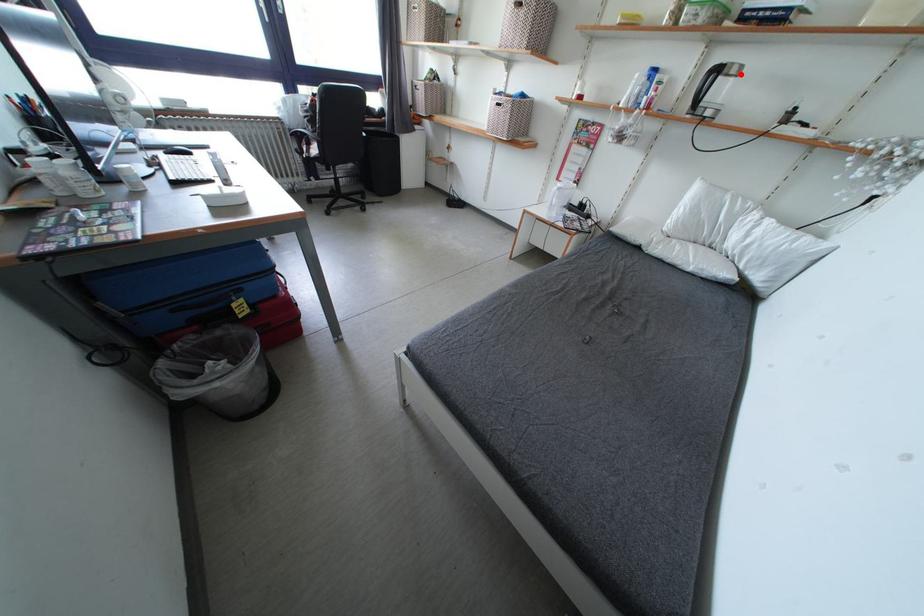
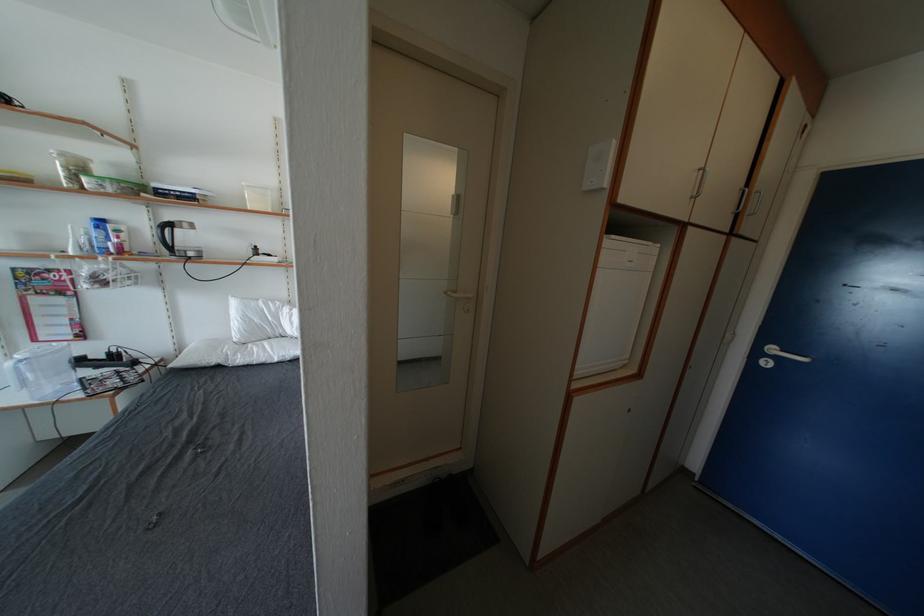
Find the pixel in the second image that matches the highlighted location in the first image.

(191, 230)